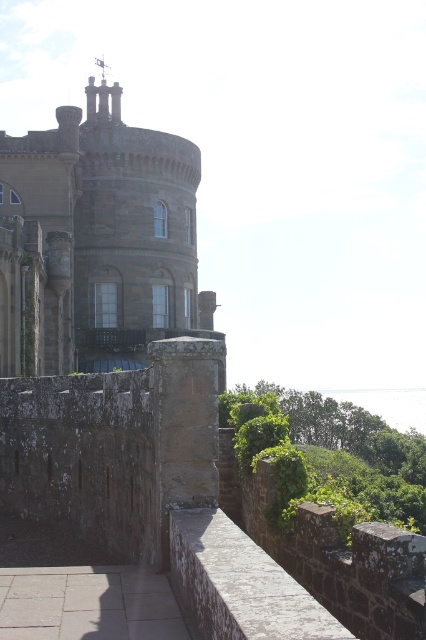
Can you confirm if stone tower at center is wider than stone wall at center?

Yes, stone tower at center is wider than stone wall at center.

Is stone tower at center in front of stone wall at center?

No, stone tower at center is behind stone wall at center.

Which is in front, point (42, 180) or point (290, 627)?

Point (290, 627)

Where is `stone tower at center`? stone tower at center is located at coordinates (103, 328).